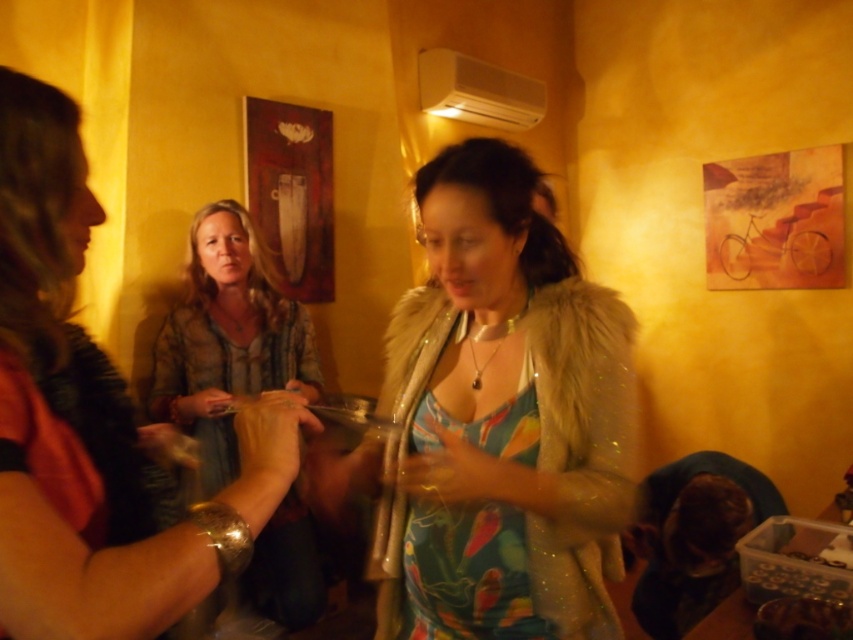
Consider the image. You are organizing a clothing display and need to place the fuzzy fur coat at center and the floral fabric dress at center side by side. Based on their sizes, which one should be placed on the left to ensure they both fit within the 2.5 meter wide display area?

The fuzzy fur coat at center is wider than the floral fabric dress at center. To fit both within the 2.5 meter display area, place the wider fuzzy fur coat at center on the left and the narrower floral fabric dress at center on the right, ensuring there is enough space between them.